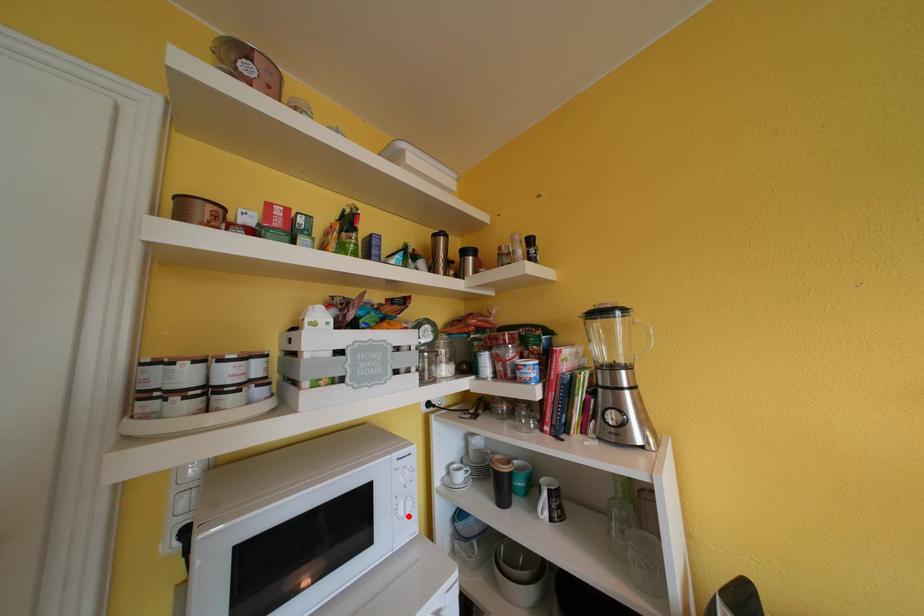
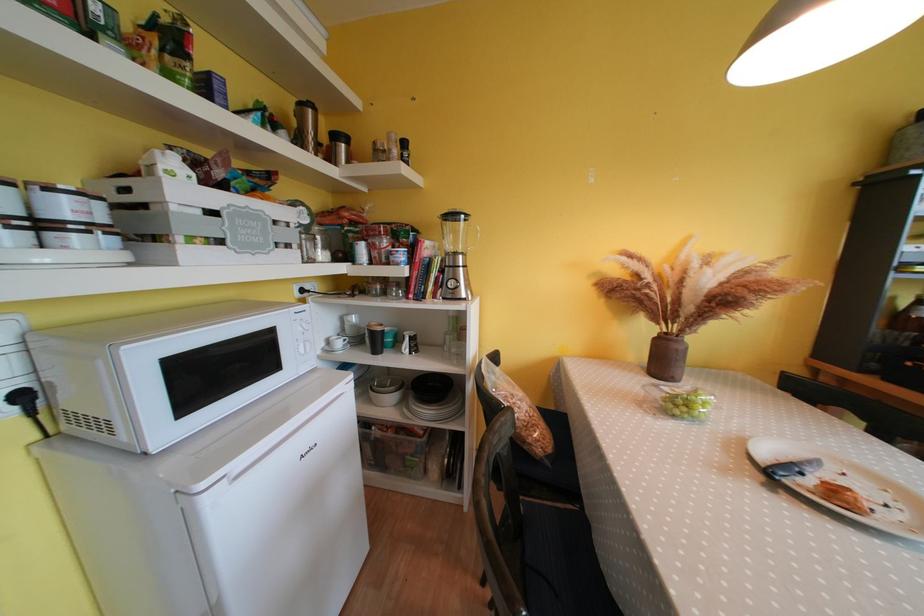
Question: I am providing you with two images of the same scene from different viewpoints. A red point is shown in image1. For the corresponding object point in image2, is it positioned nearer or farther from the camera?

Choices:
 (A) Nearer
 (B) Farther

Answer: (A)